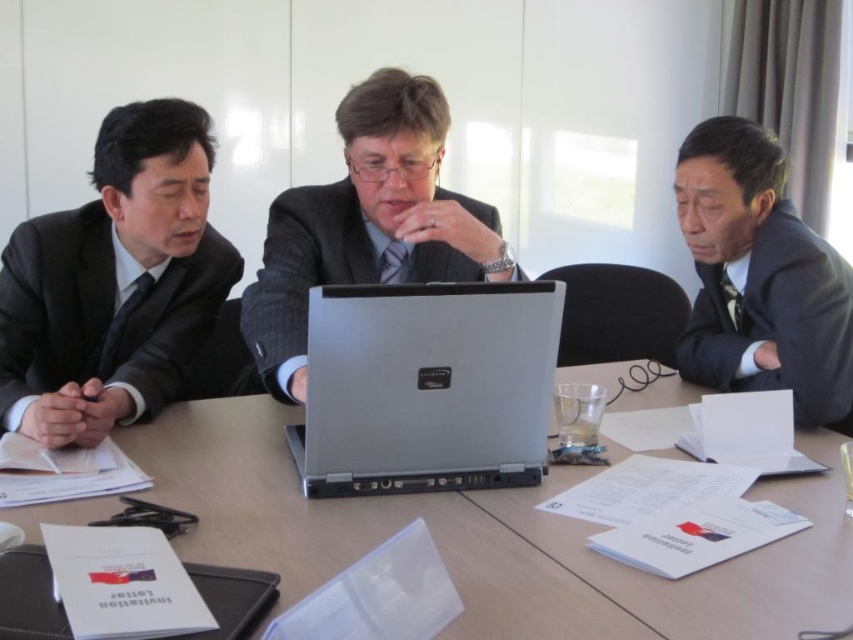
Question: Which of the following is the farthest from the observer?

Choices:
 (A) gray woolen suit at center
 (B) dark gray matte suit at left

Answer: (B)

Question: Which object is farther from the camera taking this photo?

Choices:
 (A) gray woolen suit at center
 (B) dark gray suit at right
 (C) silver metallic laptop at center
 (D) dark gray matte suit at left

Answer: (B)

Question: Is dark gray matte suit at left to the left of gray woolen suit at center from the viewer's perspective?

Choices:
 (A) no
 (B) yes

Answer: (B)

Question: Can you confirm if dark gray suit at right is smaller than gray woolen suit at center?

Choices:
 (A) yes
 (B) no

Answer: (A)

Question: In this image, where is wooden table at center located relative to gray woolen suit at center?

Choices:
 (A) right
 (B) left

Answer: (A)

Question: Among these objects, which one is nearest to the camera?

Choices:
 (A) wooden table at center
 (B) dark gray suit at right
 (C) silver metallic laptop at center
 (D) dark gray matte suit at left

Answer: (A)